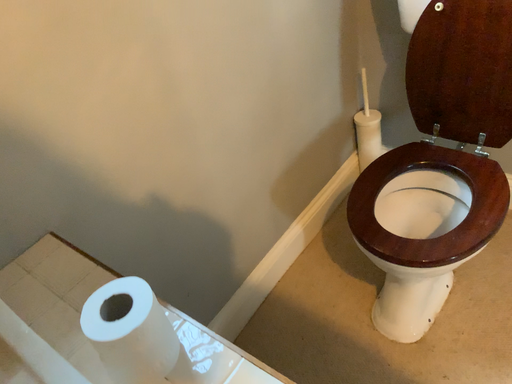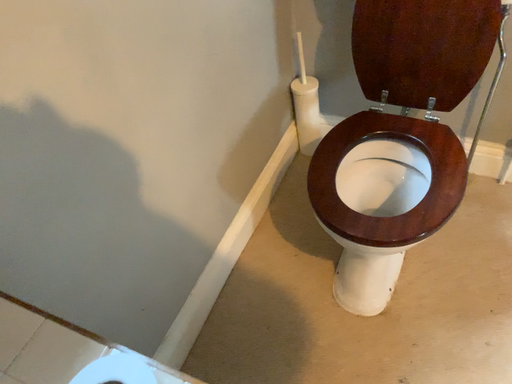
Question: Which way did the camera rotate in the video?

Choices:
 (A) rotated left
 (B) rotated right

Answer: (B)